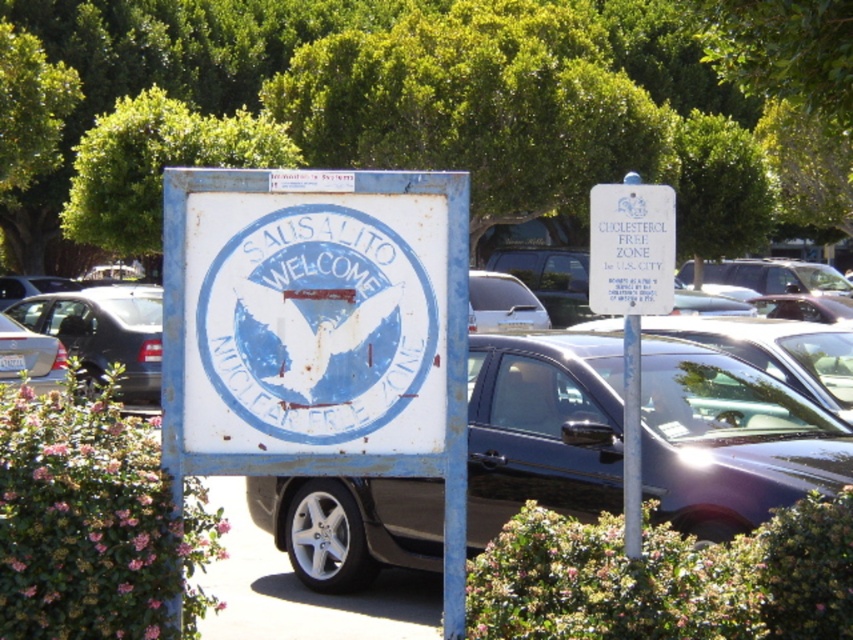
You are standing at the entrance of the parking lot and see the point marked by the coordinates (730, 440). What object is located at that point?

The metallic gray sedan at center is located at the point marked by the coordinates (730, 440).

You are a parking attendant trying to fit a new vehicle into the parking lot. The shiny silver sedan at left is smaller than the satin silver car at center. Which vehicle would require more space to park?

The satin silver car at center requires more space to park because it is larger than the shiny silver sedan at left.